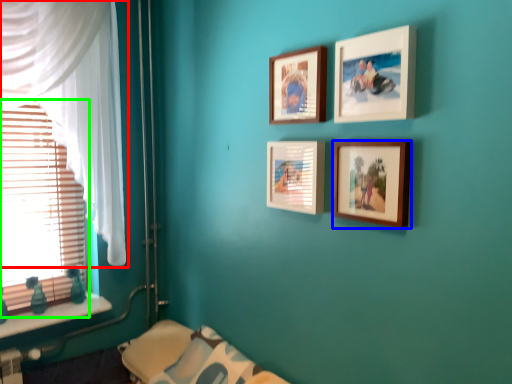
Question: Which is farther away from curtain (highlighted by a red box)? picture frame (highlighted by a blue box) or window blind (highlighted by a green box)?

Choices:
 (A) picture frame
 (B) window blind

Answer: (A)